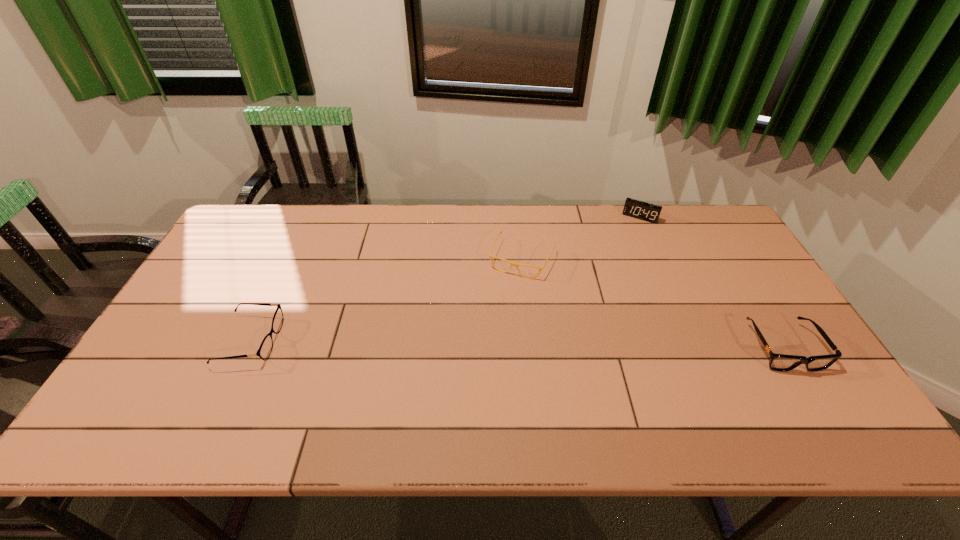
Where is `the leftmost object`? This screenshot has width=960, height=540. the leftmost object is located at coordinates (265, 349).

The image size is (960, 540). What are the coordinates of `the nearer spectacles` in the screenshot? It's located at (265, 349).

Identify the location of the rightmost object. (778, 362).

The height and width of the screenshot is (540, 960). In order to click on the third object from right to left in this screenshot , I will do `click(490, 256)`.

The image size is (960, 540). I want to click on the farther spectacles, so click(x=490, y=256).

You are a GUI agent. You are given a task and a screenshot of the screen. Output one action in this format:
    pyautogui.click(x=<x>, y=<y>)
    Task: Click on the farthest object
    The height and width of the screenshot is (540, 960).
    Given the screenshot: What is the action you would take?
    pyautogui.click(x=637, y=209)

Locate an element on the screen. The image size is (960, 540). alarm clock is located at coordinates (637, 209).

Where is `free space located on the front-facing side of the left spectacles`? free space located on the front-facing side of the left spectacles is located at coordinates (429, 341).

The height and width of the screenshot is (540, 960). What are the coordinates of `free space located 0.270m in front of the lenses of the third object from right to left` in the screenshot? It's located at (481, 348).

Find the location of `vacant space located 0.080m in front of the lenses of the third object from right to left`. vacant space located 0.080m in front of the lenses of the third object from right to left is located at coordinates pyautogui.click(x=504, y=298).